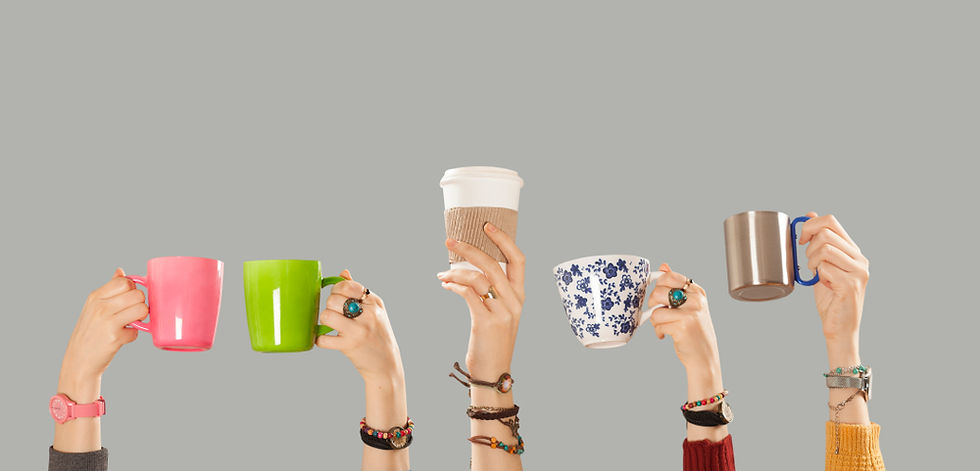
Where is `mug handles`? The height and width of the screenshot is (471, 980). mug handles is located at coordinates (142, 325), (320, 327), (647, 311), (808, 284).